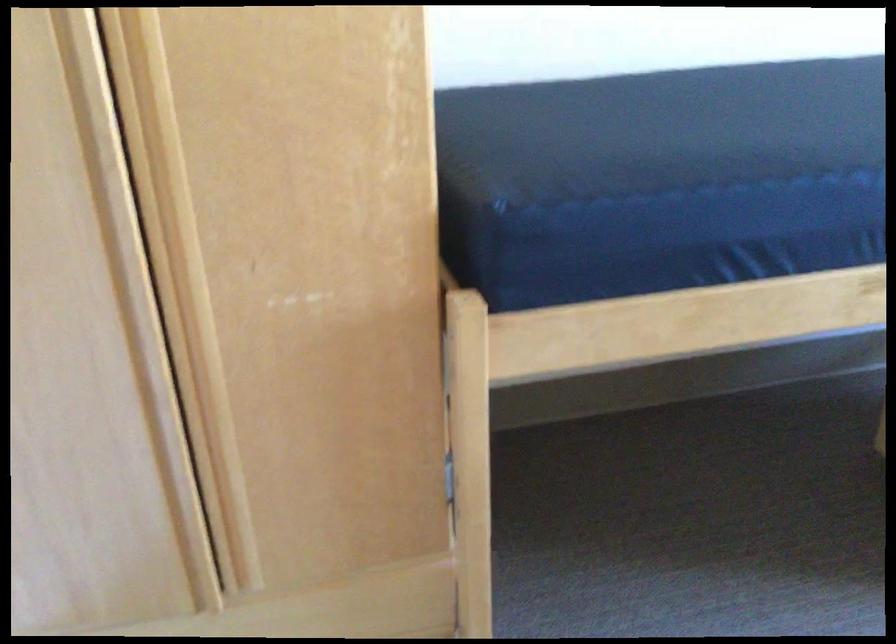
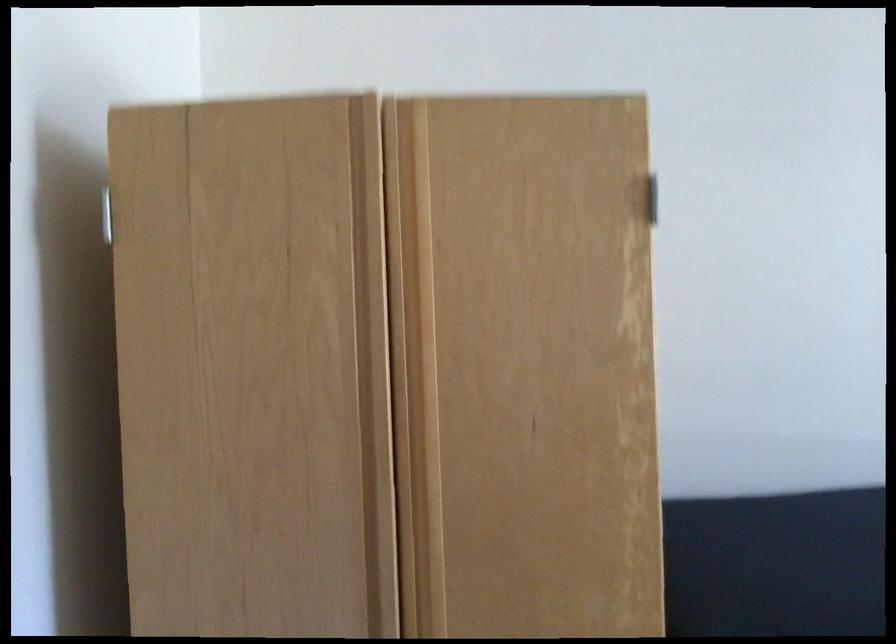
Question: The images are taken continuously from a first-person perspective. In which direction is your viewpoint rotating?

Choices:
 (A) Left
 (B) Right
 (C) Up
 (D) Down

Answer: (C)